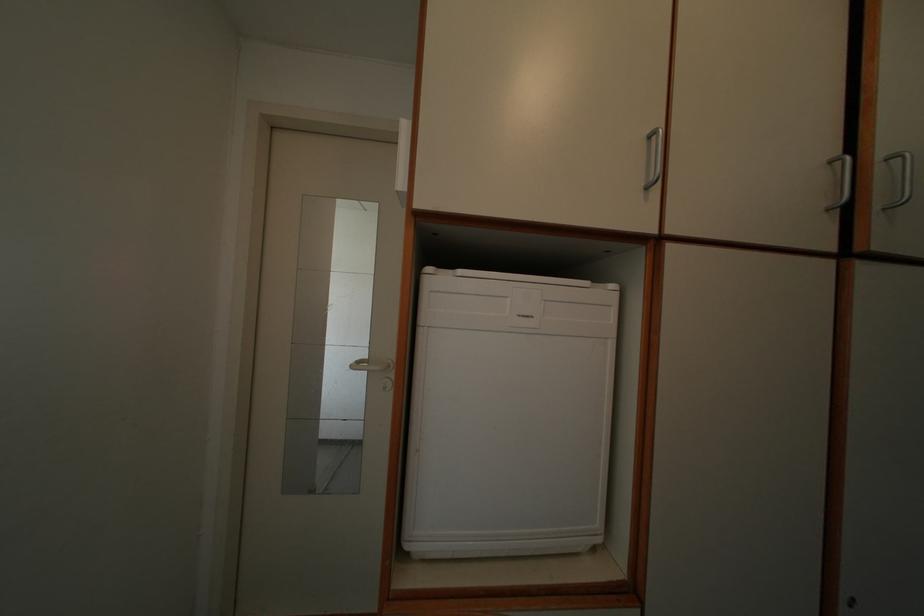
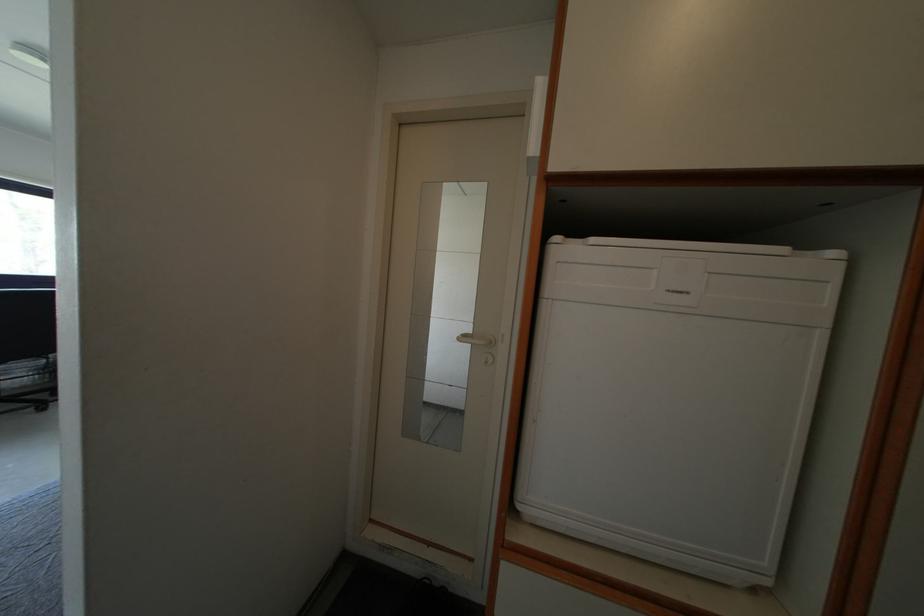
Question: How did the camera likely rotate?

Choices:
 (A) Left
 (B) Right
 (C) Up
 (D) Down

Answer: (A)